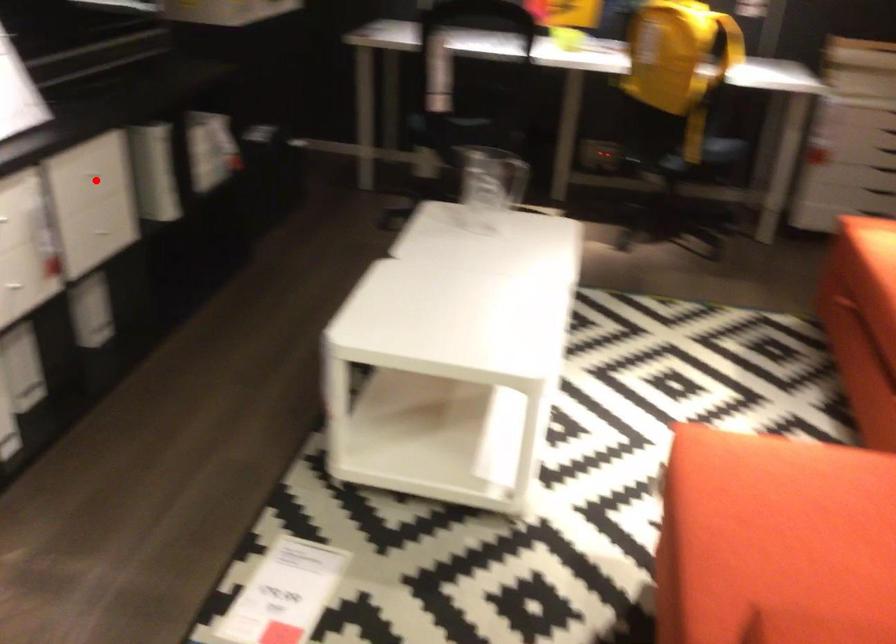
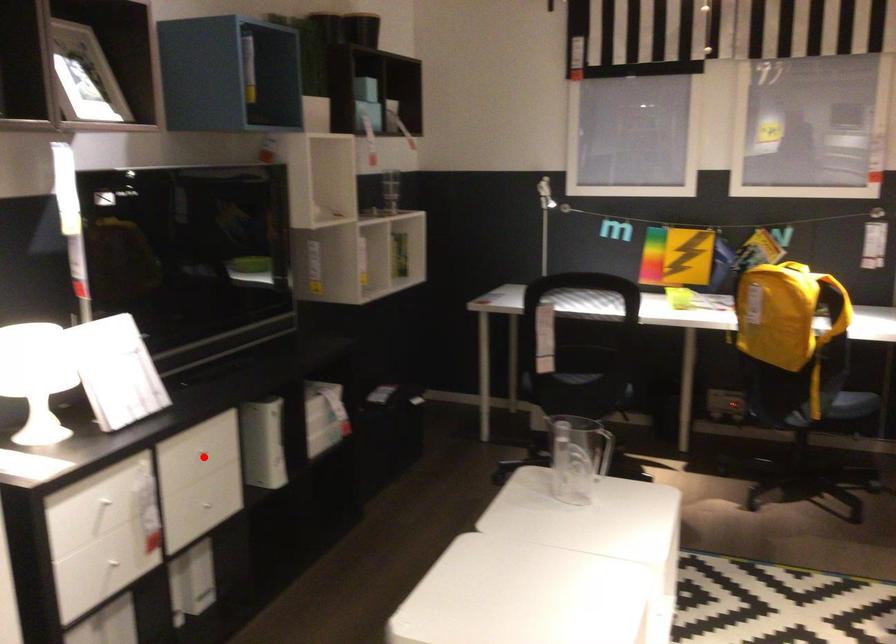
I am providing you with two images of the same scene from different viewpoints. A red point is marked on the first image and another point is marked on the second image. Does the point marked in image1 correspond to the same location as the one in image2?

Yes